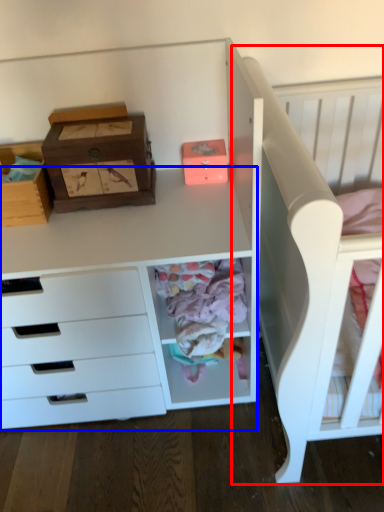
Question: Which of the following is the closest to the observer, bed (highlighted by a red box) or computer desk (highlighted by a blue box)?

Choices:
 (A) bed
 (B) computer desk

Answer: (A)